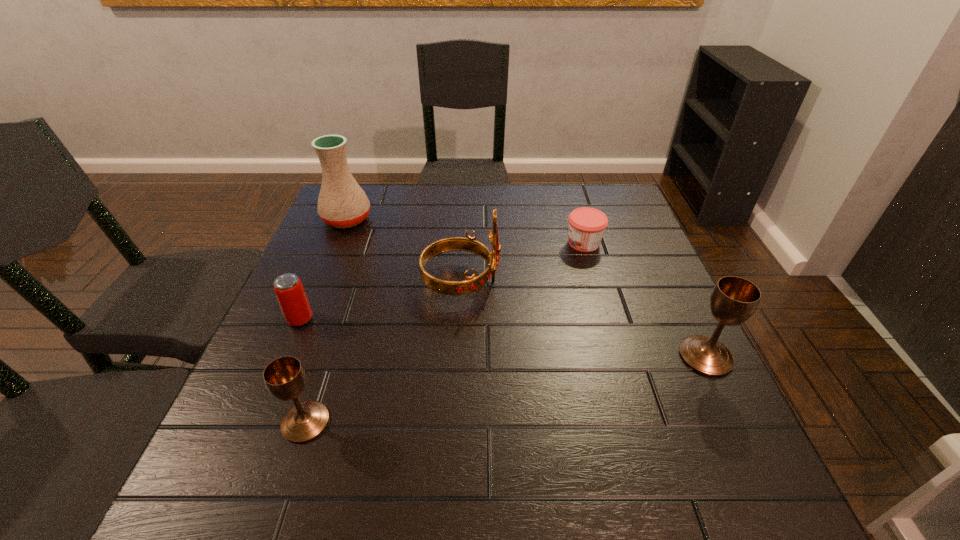
The width and height of the screenshot is (960, 540). In order to click on vacant area that lies between the pottery and the tiara in this screenshot , I will do `click(404, 250)`.

At what (x,y) coordinates should I click in order to perform the action: click on free space that is in between the shortest object and the third shortest object. Please return your answer as a coordinate pair (x, y). Image resolution: width=960 pixels, height=540 pixels. Looking at the image, I should click on (444, 333).

Locate an element on the screen. This screenshot has height=540, width=960. free space between the nearest object and the shortest object is located at coordinates (444, 333).

I want to click on object identified as the second closest to the left chalice, so click(x=471, y=284).

Identify which object is the third nearest to the shortest object. Please provide its 2D coordinates. Your answer should be formatted as a tuple, i.e. [(x, y)], where the tuple contains the x and y coordinates of a point satisfying the conditions above.

[(342, 203)]

Identify the location of free region that satisfies the following two spatial constraints: 1. on the front label of the jam; 2. on the left side of the farther chalice. Image resolution: width=960 pixels, height=540 pixels. (617, 356).